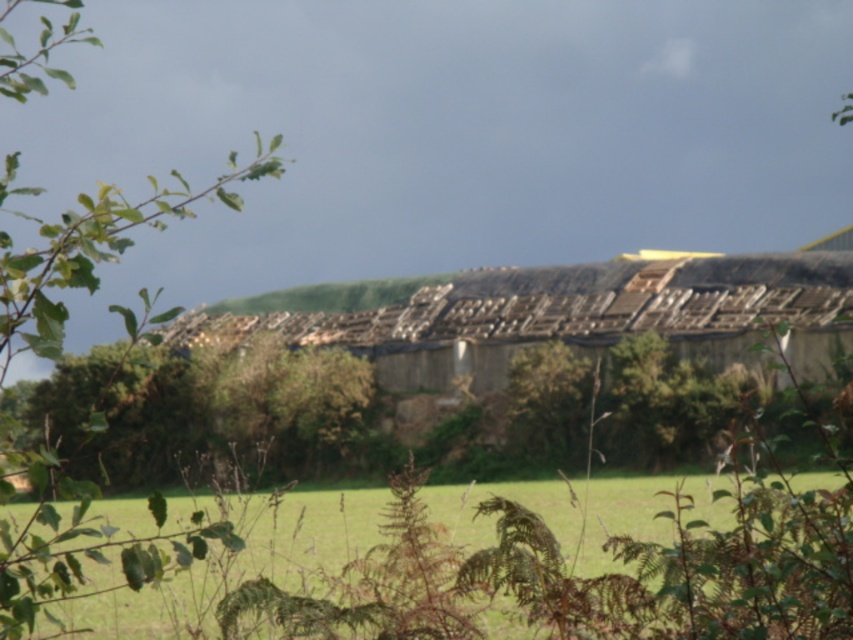
You are standing in front of the dilapidated building and notice the green grass at lower center and the green leafy branch at left. Which object is shorter?

The green grass at lower center is shorter than the green leafy branch at left.

You are standing in front of the dilapidated building and want to walk towards the green grass at lower center. What are the coordinates where you should aim to step on?

The coordinates for the green grass at lower center are point (558, 576). You should aim to step on those coordinates.

You are standing in front of the dilapidated building and want to take a photo. There are two points marked in the scene, point 1 at coordinates point (219, 611) and point 2 at coordinates point (119, 547). Which point is closer to your camera lens when taking the photo?

Point (219, 611) is closer to the camera lens than point (119, 547).